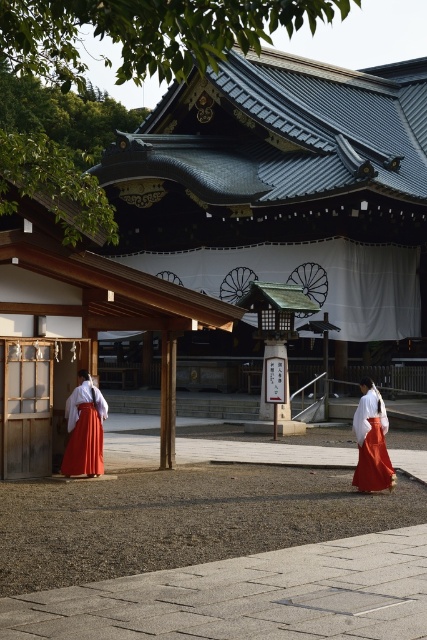
Question: Can you confirm if matte red skirt at left is positioned below matte white kimono at center?

Choices:
 (A) no
 (B) yes

Answer: (A)

Question: Which object is farther from the camera taking this photo?

Choices:
 (A) matte white kimono at center
 (B) matte red skirt at left

Answer: (B)

Question: Can you confirm if matte red skirt at left is positioned below matte white kimono at center?

Choices:
 (A) yes
 (B) no

Answer: (B)

Question: Does matte red skirt at left appear on the right side of matte white kimono at center?

Choices:
 (A) yes
 (B) no

Answer: (B)

Question: Which point is closer to the camera taking this photo?

Choices:
 (A) (368, 458)
 (B) (70, 426)

Answer: (A)